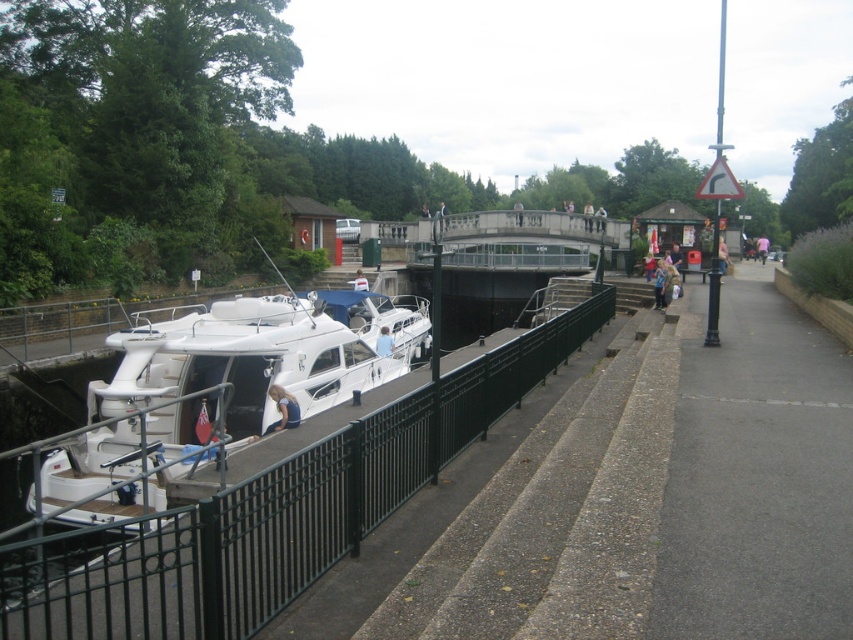
Question: Which point appears closest to the camera in this image?

Choices:
 (A) (183, 627)
 (B) (660, 298)
 (C) (163, 364)

Answer: (A)

Question: Which of the following is the farthest from the observer?

Choices:
 (A) (375, 344)
 (B) (761, 262)

Answer: (B)

Question: Based on their relative distances, which object is farther from the blue fabric shirt at lower left?

Choices:
 (A) white glossy boat at left
 (B) blue denim jacket at lower right
 (C) blue fabric shirt at lower center

Answer: (B)

Question: Is white glossy boat at left below pink fabric person at center-right?

Choices:
 (A) yes
 (B) no

Answer: (A)

Question: Is black metal fence at lower left wider than blue fabric shirt at center?

Choices:
 (A) no
 (B) yes

Answer: (B)

Question: Is the position of black metal fence at lower left less distant than that of blue denim jacket at lower right?

Choices:
 (A) yes
 (B) no

Answer: (A)